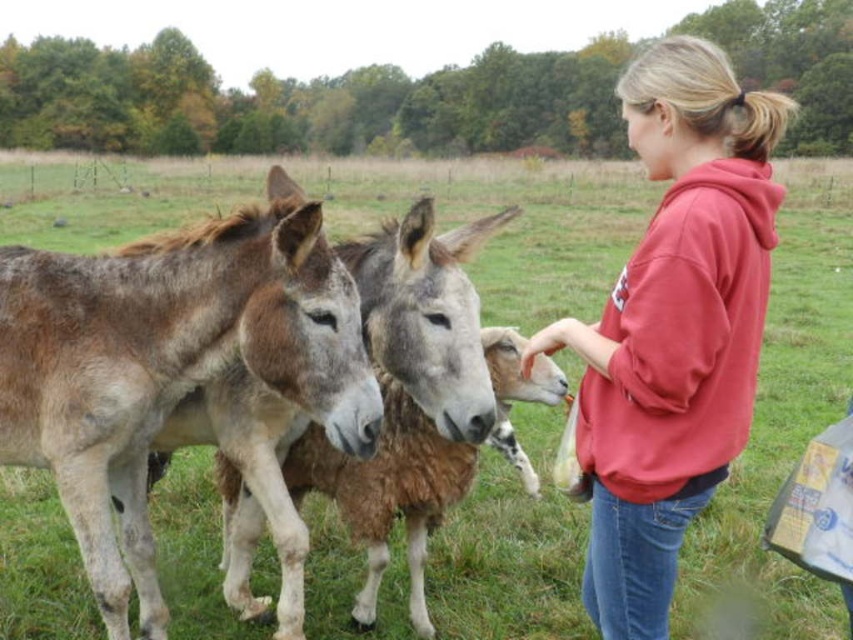
Question: Does brown fuzzy mule at left have a smaller size compared to red fleece sweatshirt at center?

Choices:
 (A) yes
 (B) no

Answer: (A)

Question: Which object appears closest to the camera in this image?

Choices:
 (A) brown fuzzy mule at left
 (B) red fleece sweatshirt at center

Answer: (B)

Question: Can you confirm if brown fuzzy mule at left is positioned below red fleece sweatshirt at center?

Choices:
 (A) yes
 (B) no

Answer: (A)

Question: From the image, what is the correct spatial relationship of brown fuzzy mule at left in relation to red fleece sweatshirt at center?

Choices:
 (A) above
 (B) below

Answer: (B)

Question: Which of the following is the farthest from the observer?

Choices:
 (A) (117, 547)
 (B) (724, 128)

Answer: (A)